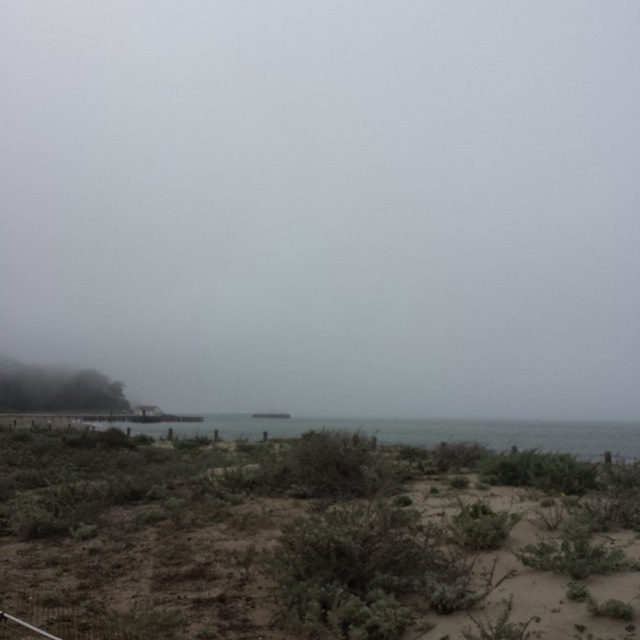
Question: Which object is the farthest from the foggy misty sky at upper center?

Choices:
 (A) clear water at center
 (B) brown sandy soil at lower center

Answer: (B)

Question: Estimate the real-world distances between objects in this image. Which object is farther from the brown sandy soil at lower center?

Choices:
 (A) foggy misty sky at upper center
 (B) clear water at center

Answer: (A)

Question: Is brown sandy soil at lower center in front of clear water at center?

Choices:
 (A) yes
 (B) no

Answer: (A)

Question: Which point appears farthest from the camera in this image?

Choices:
 (A) (401, 435)
 (B) (321, 509)

Answer: (A)

Question: Is foggy misty sky at upper center positioned behind brown sandy soil at lower center?

Choices:
 (A) yes
 (B) no

Answer: (A)

Question: Is foggy misty sky at upper center to the left of clear water at center from the viewer's perspective?

Choices:
 (A) yes
 (B) no

Answer: (A)